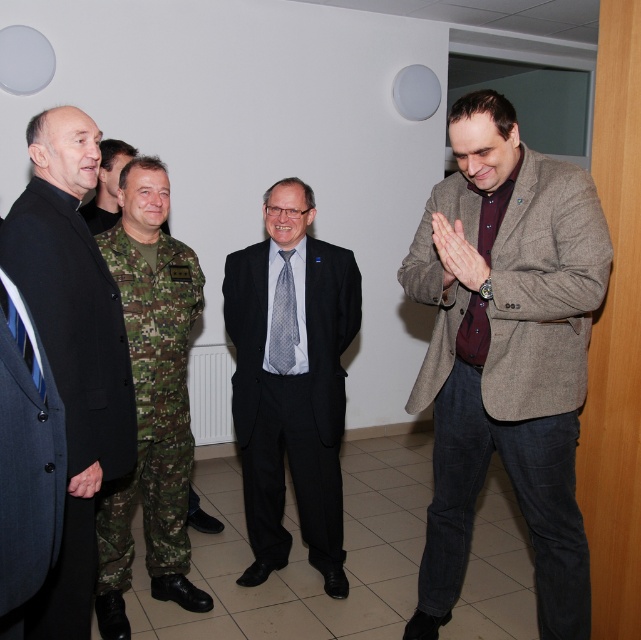
Which is behind, point (319, 259) or point (110, 339)?

Point (319, 259)

Image resolution: width=641 pixels, height=640 pixels. In order to click on dark gray suit at center in this screenshot , I will do `click(292, 381)`.

Does point (513, 442) come in front of point (54, 298)?

No, it is behind (54, 298).

At what (x,y) coordinates should I click in order to perform the action: click on matte gray blazer at right. Please return your answer as a coordinate pair (x, y). This screenshot has height=640, width=641. Looking at the image, I should click on (506, 353).

Can you confirm if dark blue suit at left is positioned below gray dotted tie at center?

Indeed, dark blue suit at left is positioned under gray dotted tie at center.

Can you confirm if dark blue suit at left is positioned above gray dotted tie at center?

Incorrect, dark blue suit at left is not positioned above gray dotted tie at center.

Which is behind, point (53, 156) or point (278, 362)?

Positioned behind is point (278, 362).

You are a GUI agent. You are given a task and a screenshot of the screen. Output one action in this format:
    pyautogui.click(x=<x>, y=<y>)
    Task: Click on the dark blue suit at left
    Image resolution: width=641 pixels, height=640 pixels.
    Given the screenshot: What is the action you would take?
    (x=72, y=349)